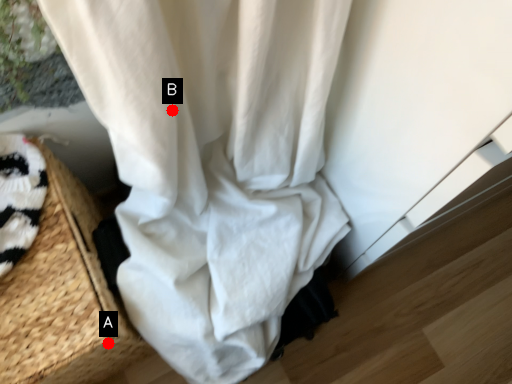
Question: Two points are circled on the image, labeled by A and B beside each circle. Among these points, which one is nearest to the camera?

Choices:
 (A) A is closer
 (B) B is closer

Answer: (B)